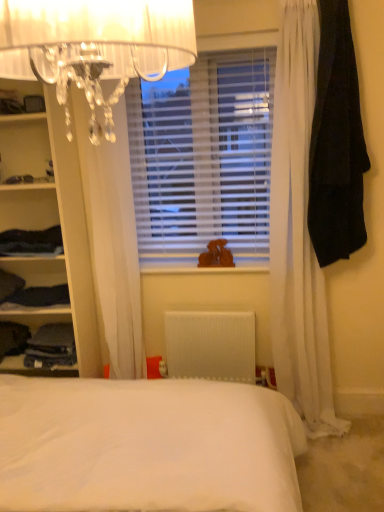
The height and width of the screenshot is (512, 384). Identify the location of free space above white plastic blinds at center (from a real-world perspective). (222, 35).